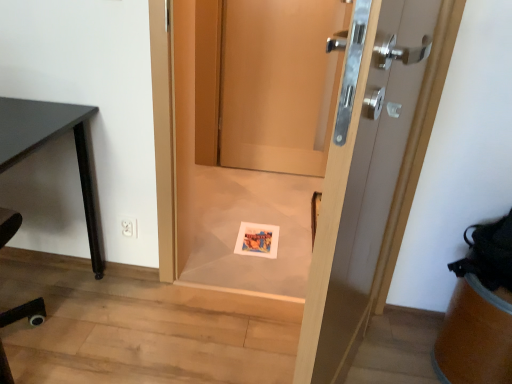
Measure the distance between matte wood door at center, positioned as the 2th door in back-to-front order, and camera.

matte wood door at center, positioned as the 2th door in back-to-front order, is 4.51 feet from camera.

Describe the element at coordinates (46, 142) in the screenshot. The image size is (512, 384). I see `matte black desk at left` at that location.

What do you see at coordinates (279, 83) in the screenshot?
I see `wooden door at center, the third door positioned from the front` at bounding box center [279, 83].

Image resolution: width=512 pixels, height=384 pixels. Describe the element at coordinates (128, 226) in the screenshot. I see `white plastic electric outlet at lower left` at that location.

You are a GUI agent. You are given a task and a screenshot of the screen. Output one action in this format:
    pyautogui.click(x=<x>, y=<y>)
    Task: Click on the matte wood door at center, the 1th door when ordered from front to back
    The image size is (512, 384).
    Given the screenshot: What is the action you would take?
    pyautogui.click(x=362, y=177)

This screenshot has height=384, width=512. Identify the location of desk located in front of the wooden door at center, the third door positioned from the front. (46, 142).

Considering the sizes of matte black desk at left and wooden door at center, the first door in the back-to-front sequence, in the image, is matte black desk at left taller or shorter than wooden door at center, the first door in the back-to-front sequence,?

Considering their sizes, matte black desk at left has less height than wooden door at center, the first door in the back-to-front sequence.

From the image's perspective, between matte black desk at left and wooden door at center, the third door positioned from the front, which one is located above?

wooden door at center, the third door positioned from the front, is shown above in the image.

From a real-world perspective, is matte black desk at left on top of wooden door at center, the first door in the back-to-front sequence?

No, from a real-world perspective, matte black desk at left is not over wooden door at center, the first door in the back-to-front sequence

Is matte wood door at center, the 1th door when ordered from front to back, outside of matte wood door at center, marked as the 2th door in a front-to-back arrangement?

That's correct, matte wood door at center, the 1th door when ordered from front to back, is outside of matte wood door at center, marked as the 2th door in a front-to-back arrangement.

Which is in front, point (336, 192) or point (241, 260)?

The point (336, 192) is closer.

In the scene shown: From the image's perspective, is matte wood door at center, acting as the third door starting from the back, on matte wood door at center, positioned as the 2th door in back-to-front order?

No.

Which of these two, matte wood door at center, positioned as the 2th door in back-to-front order, or matte black desk at left, is wider?

matte black desk at left.

Could matte black desk at left be considered to be inside matte wood door at center, positioned as the 2th door in back-to-front order?

No, matte black desk at left is not surrounded by matte wood door at center, positioned as the 2th door in back-to-front order.

From the image's perspective, is matte wood door at center, positioned as the 2th door in back-to-front order, beneath matte black desk at left?

No, from the image's perspective, matte wood door at center, positioned as the 2th door in back-to-front order, is not below matte black desk at left.

What's the angular difference between matte wood door at center, marked as the 2th door in a front-to-back arrangement, and matte black desk at left's facing directions?

matte wood door at center, marked as the 2th door in a front-to-back arrangement, and matte black desk at left are facing 0.169 degrees away from each other.

Which is in front, matte wood door at center, marked as the 2th door in a front-to-back arrangement, or wooden door at center, the first door in the back-to-front sequence?

matte wood door at center, marked as the 2th door in a front-to-back arrangement.

Would you consider matte wood door at center, marked as the 2th door in a front-to-back arrangement, to be distant from wooden door at center, the third door positioned from the front?

matte wood door at center, marked as the 2th door in a front-to-back arrangement, is actually quite close to wooden door at center, the third door positioned from the front.

Do you think matte wood door at center, marked as the 2th door in a front-to-back arrangement, is within wooden door at center, the third door positioned from the front, or outside of it?

matte wood door at center, marked as the 2th door in a front-to-back arrangement, is outside wooden door at center, the third door positioned from the front.

Is matte wood door at center, positioned as the 2th door in back-to-front order, aimed at wooden door at center, the first door in the back-to-front sequence?

No, matte wood door at center, positioned as the 2th door in back-to-front order, does not turn towards wooden door at center, the first door in the back-to-front sequence.

You are a GUI agent. You are given a task and a screenshot of the screen. Output one action in this format:
    pyautogui.click(x=<x>, y=<y>)
    Task: Click on the door above the matte wood door at center, positioned as the 2th door in back-to-front order (from the image's perspective)
    
    Given the screenshot: What is the action you would take?
    pyautogui.click(x=279, y=83)

Considering the sizes of wooden door at center, the first door in the back-to-front sequence, and matte wood door at center, positioned as the 2th door in back-to-front order, in the image, is wooden door at center, the first door in the back-to-front sequence, bigger or smaller than matte wood door at center, positioned as the 2th door in back-to-front order,?

In the image, wooden door at center, the first door in the back-to-front sequence, appears to be smaller than matte wood door at center, positioned as the 2th door in back-to-front order.

In the scene shown: Is matte wood door at center, positioned as the 2th door in back-to-front order, at the back of wooden door at center, the first door in the back-to-front sequence?

No.

Is matte wood door at center, the 1th door when ordered from front to back, aimed at wooden door at center, the first door in the back-to-front sequence?

No, matte wood door at center, the 1th door when ordered from front to back, is not aimed at wooden door at center, the first door in the back-to-front sequence.

Which is closer to the camera, [326,185] or [264,168]?

Point [326,185] appears to be closer to the viewer than point [264,168].

From a real-world perspective, which object rests below the other?

wooden door at center, the first door in the back-to-front sequence, is physically lower.

Relative to wooden door at center, the third door positioned from the front, is matte wood door at center, the 1th door when ordered from front to back, in front or behind?

Clearly, matte wood door at center, the 1th door when ordered from front to back, is in front of wooden door at center, the third door positioned from the front.

Between matte wood door at center, marked as the 2th door in a front-to-back arrangement, and matte paper postcard at center, which one appears on the right side from the viewer's perspective?

From the viewer's perspective, matte wood door at center, marked as the 2th door in a front-to-back arrangement, appears more on the right side.

Is matte wood door at center, positioned as the 2th door in back-to-front order, positioned beyond the bounds of matte paper postcard at center?

That's correct, matte wood door at center, positioned as the 2th door in back-to-front order, is outside of matte paper postcard at center.

Considering the sizes of objects matte wood door at center, marked as the 2th door in a front-to-back arrangement, and matte paper postcard at center in the image provided, who is bigger, matte wood door at center, marked as the 2th door in a front-to-back arrangement, or matte paper postcard at center?

matte wood door at center, marked as the 2th door in a front-to-back arrangement.

What's the angular difference between matte wood door at center, marked as the 2th door in a front-to-back arrangement, and matte paper postcard at center's facing directions?

There is a 0.732-degree angle between the facing directions of matte wood door at center, marked as the 2th door in a front-to-back arrangement, and matte paper postcard at center.

This screenshot has width=512, height=384. Identify the location of the 2nd door to the right of the matte black desk at left, starting your count from the anchor. (279, 83).

Find the location of a particular element. This screenshot has height=384, width=512. door in front of the matte wood door at center, positioned as the 2th door in back-to-front order is located at coordinates (362, 177).

Estimate the real-world distances between objects in this image. Which object is further from matte paper postcard at center, matte wood door at center, the 1th door when ordered from front to back, or matte black desk at left?

matte wood door at center, the 1th door when ordered from front to back, is positioned further to the anchor matte paper postcard at center.

Estimate the real-world distances between objects in this image. Which object is closer to white plastic electric outlet at lower left, wooden door at center, the third door positioned from the front, or matte wood door at center, marked as the 2th door in a front-to-back arrangement?

Answer: matte wood door at center, marked as the 2th door in a front-to-back arrangement, is closer to white plastic electric outlet at lower left.

Which object lies nearer to the anchor point matte paper postcard at center, white plastic electric outlet at lower left or wooden door at center, the third door positioned from the front?

white plastic electric outlet at lower left.

From the image, which object appears to be farther from matte black desk at left, matte wood door at center, acting as the third door starting from the back, or wooden door at center, the first door in the back-to-front sequence?

Based on the image, wooden door at center, the first door in the back-to-front sequence, appears to be further to matte black desk at left.

In the scene shown: Considering their positions, is wooden door at center, the third door positioned from the front, positioned further to matte wood door at center, the 1th door when ordered from front to back, than matte black desk at left?

wooden door at center, the third door positioned from the front, lies further to matte wood door at center, the 1th door when ordered from front to back, than the other object.

Estimate the real-world distances between objects in this image. Which object is closer to matte black desk at left, matte paper postcard at center or matte wood door at center, the 1th door when ordered from front to back?

Among the two, matte paper postcard at center is located nearer to matte black desk at left.

Which object lies further to the anchor point matte paper postcard at center, white plastic electric outlet at lower left or matte wood door at center, acting as the third door starting from the back?

matte wood door at center, acting as the third door starting from the back, is further to matte paper postcard at center.

Which object lies nearer to the anchor point white plastic electric outlet at lower left, matte wood door at center, acting as the third door starting from the back, or wooden door at center, the third door positioned from the front?

matte wood door at center, acting as the third door starting from the back, is positioned closer to the anchor white plastic electric outlet at lower left.

Find the location of a particular element. This screenshot has width=512, height=384. electric outlet between matte black desk at left and matte paper postcard at center along the z-axis is located at coordinates (128, 226).

Identify the location of desk located between matte wood door at center, the 1th door when ordered from front to back, and matte paper postcard at center in the depth direction. (46, 142).

I want to click on postcard positioned between matte wood door at center, positioned as the 2th door in back-to-front order, and wooden door at center, the first door in the back-to-front sequence, from near to far, so click(257, 240).

In order to click on electric outlet between matte black desk at left and matte wood door at center, acting as the third door starting from the back, in the horizontal direction in this screenshot , I will do `click(128, 226)`.